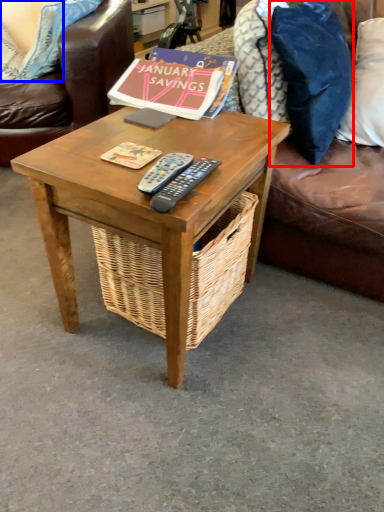
Question: Which point is closer to the camera, pillow (highlighted by a red box) or pillow (highlighted by a blue box)?

Choices:
 (A) pillow
 (B) pillow

Answer: (A)